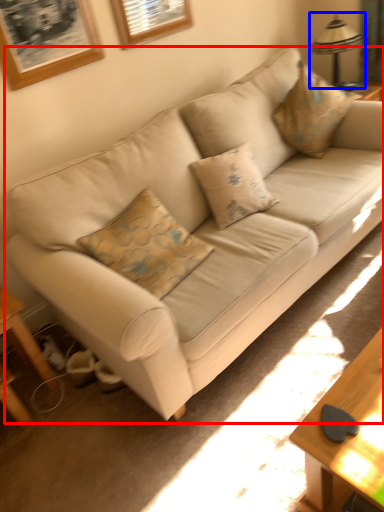
Question: Which of the following is the closest to the observer, studio couch (highlighted by a red box) or table lamp (highlighted by a blue box)?

Choices:
 (A) studio couch
 (B) table lamp

Answer: (A)